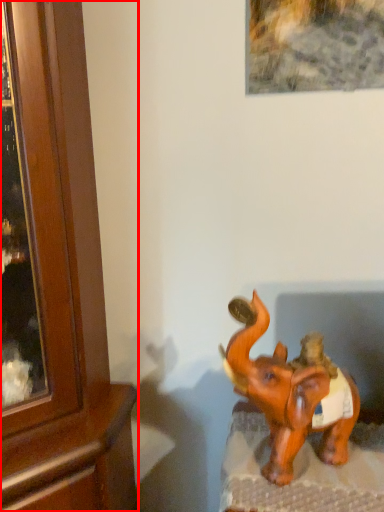
Question: From the image, what is the correct spatial relationship of cabinetry (annotated by the red box) in relation to elephant?

Choices:
 (A) right
 (B) left

Answer: (B)